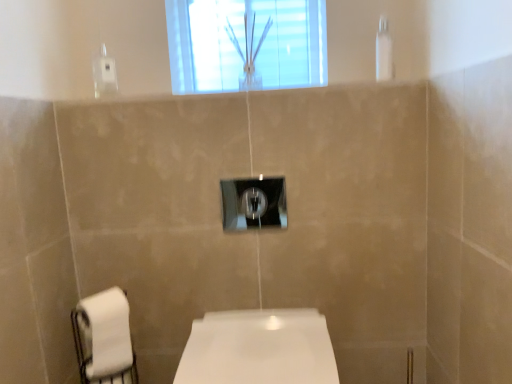
Question: Considering the positions of white glossy toilet at center and clear glass vase at upper center in the image, is white glossy toilet at center wider or thinner than clear glass vase at upper center?

Choices:
 (A) thin
 (B) wide

Answer: (B)

Question: From a real-world perspective, is white glossy toilet at center above or below clear glass vase at upper center?

Choices:
 (A) above
 (B) below

Answer: (B)

Question: Which object is the farthest from the satin nickel light switch at center?

Choices:
 (A) clear plastic shower at upper right
 (B) clear glass vase at upper center
 (C) white matte toilet paper at lower left
 (D) white glossy toilet at center

Answer: (B)

Question: Considering the real-world distances, which object is farthest from the satin nickel light switch at center?

Choices:
 (A) clear glass vase at upper center
 (B) white matte toilet paper at lower left
 (C) clear plastic shower at upper right
 (D) white glossy toilet at center

Answer: (A)